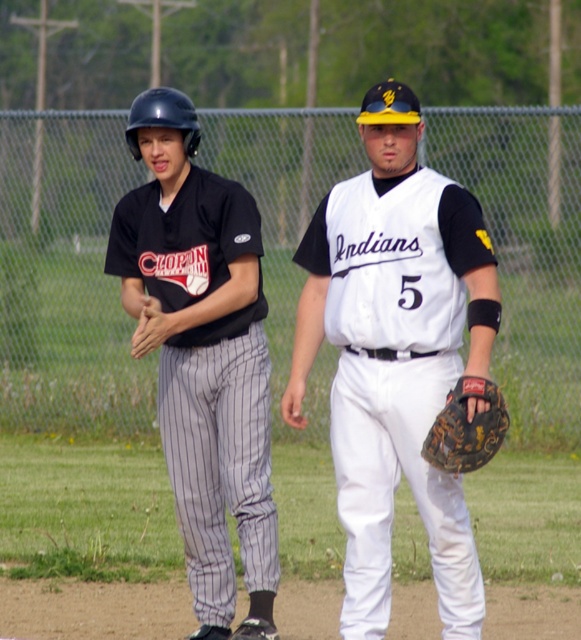
Between point (164, 285) and point (243, 529), which one is positioned in front?

Point (243, 529)

In the scene shown: Is matte black helmet at left positioned in front of matte black jersey at left?

Yes.

Locate an element on the screen. This screenshot has width=581, height=640. matte black helmet at left is located at coordinates (396, 355).

Can you confirm if matte black jersey at left is bigger than camouflage leather glove at center?

Correct, matte black jersey at left is larger in size than camouflage leather glove at center.

Which is below, matte black jersey at left or camouflage leather glove at center?

camouflage leather glove at center is lower down.

Is point (252, 401) closer to viewer compared to point (471, 468)?

No, (252, 401) is behind (471, 468).

Identify the location of matte black jersey at left. (216, 465).

Which is more to the left, matte black helmet at left or white matte jersey at center?

From the viewer's perspective, matte black helmet at left appears more on the left side.

Can you confirm if matte black helmet at left is smaller than white matte jersey at center?

Incorrect, matte black helmet at left is not smaller in size than white matte jersey at center.

Describe the element at coordinates (396, 355) in the screenshot. This screenshot has width=581, height=640. I see `matte black helmet at left` at that location.

Locate an element on the screen. matte black helmet at left is located at coordinates (396, 355).